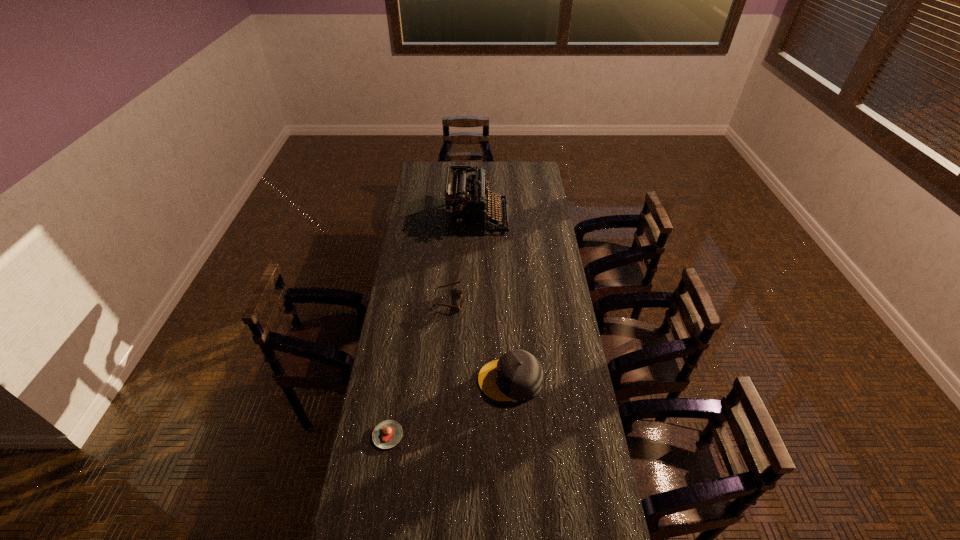
At what (x,y) coordinates should I click in order to perform the action: click on free space located on the front-facing side of the second nearest object. Please return your answer as a coordinate pair (x, y). Looking at the image, I should click on (389, 380).

I want to click on vacant space located on the front-facing side of the second nearest object, so click(411, 380).

The width and height of the screenshot is (960, 540). I want to click on free space located 0.330m on the frames of the third nearest object, so point(539,301).

Locate an element on the screen. The image size is (960, 540). free region located on the back of the leftmost object is located at coordinates (396, 381).

The height and width of the screenshot is (540, 960). I want to click on object located at the left edge, so click(x=387, y=434).

The height and width of the screenshot is (540, 960). In order to click on object at the right edge in this screenshot , I will do `click(517, 375)`.

The width and height of the screenshot is (960, 540). In the image, there is a desktop. Identify the location of free space at the left edge. (408, 228).

Where is `vacant space at the right edge`? vacant space at the right edge is located at coordinates (601, 460).

Where is `vacant space at the far right corner of the desktop`? This screenshot has width=960, height=540. vacant space at the far right corner of the desktop is located at coordinates (521, 167).

I want to click on free space between the cap and the sunglasses, so click(x=479, y=340).